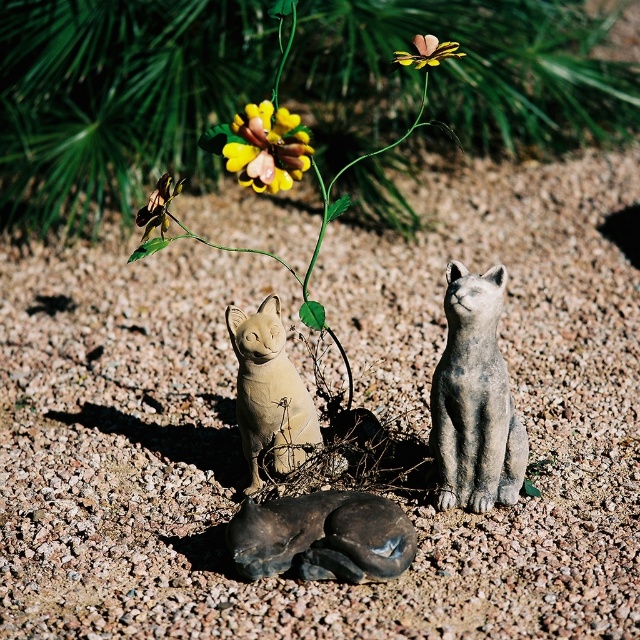
From the picture: You are a gardener checking the garden layout. You see the matte yellow flower at center and the matte stone cat at center. Which object is higher in height?

The matte yellow flower at center is taller than the matte stone cat at center.

You are a gardener who wants to place a new small statue between the two cat statues. The new statue must be smaller than the matte yellow flower at center but larger than the yellow matte flower at upper center. Can you determine if there is enough space between the two standing cat statues to place this new statue?

The matte yellow flower at center is bigger than the yellow matte flower at upper center, but the spatial relationship between the two standing cat statues isn answer the question about the available space for the new statue. Without information on the distance between the standing cat statues or the size of the new statue relative to that space, it is impossible to determine if there is enough room.